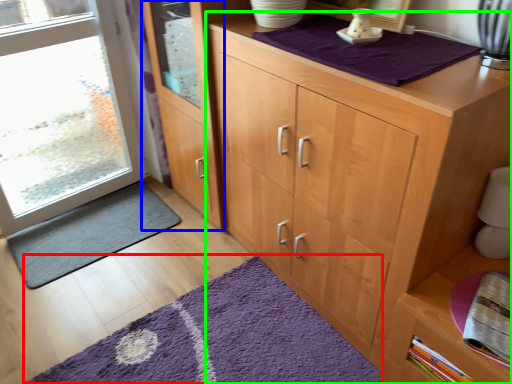
Question: Estimate the real-world distances between objects in this image. Which object is closer to doormat (highlighted by a red box), screen door (highlighted by a blue box) or cupboard (highlighted by a green box)?

Choices:
 (A) screen door
 (B) cupboard

Answer: (B)